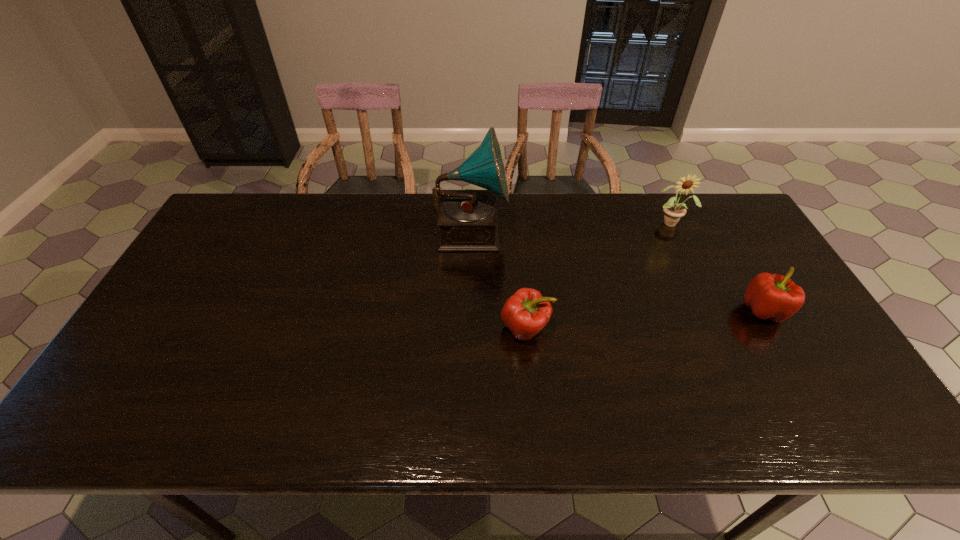
At what (x,y) coordinates should I click in order to perform the action: click on free space that satisfies the following two spatial constraints: 1. on the horn of the tallest object; 2. on the left side of the left bell pepper. Please return your answer as a coordinate pair (x, y). Looking at the image, I should click on (469, 328).

The height and width of the screenshot is (540, 960). I want to click on free space that satisfies the following two spatial constraints: 1. on the horn of the tallest object; 2. on the right side of the right bell pepper, so click(469, 310).

Where is `vacant space that satisfies the following two spatial constraints: 1. on the front-facing side of the second object from right to left; 2. on the horn of the record player`? vacant space that satisfies the following two spatial constraints: 1. on the front-facing side of the second object from right to left; 2. on the horn of the record player is located at coordinates (675, 230).

Where is `free region that satisfies the following two spatial constraints: 1. on the front-facing side of the rightmost object; 2. on the right side of the sunflower`? free region that satisfies the following two spatial constraints: 1. on the front-facing side of the rightmost object; 2. on the right side of the sunflower is located at coordinates (713, 310).

Where is `vacant space that satisfies the following two spatial constraints: 1. on the front-facing side of the second tallest object; 2. on the right side of the right bell pepper`? vacant space that satisfies the following two spatial constraints: 1. on the front-facing side of the second tallest object; 2. on the right side of the right bell pepper is located at coordinates (713, 310).

Image resolution: width=960 pixels, height=540 pixels. What are the coordinates of `blank area in the image that satisfies the following two spatial constraints: 1. on the horn of the rightmost object; 2. on the left side of the tallest object` in the screenshot? It's located at (469, 310).